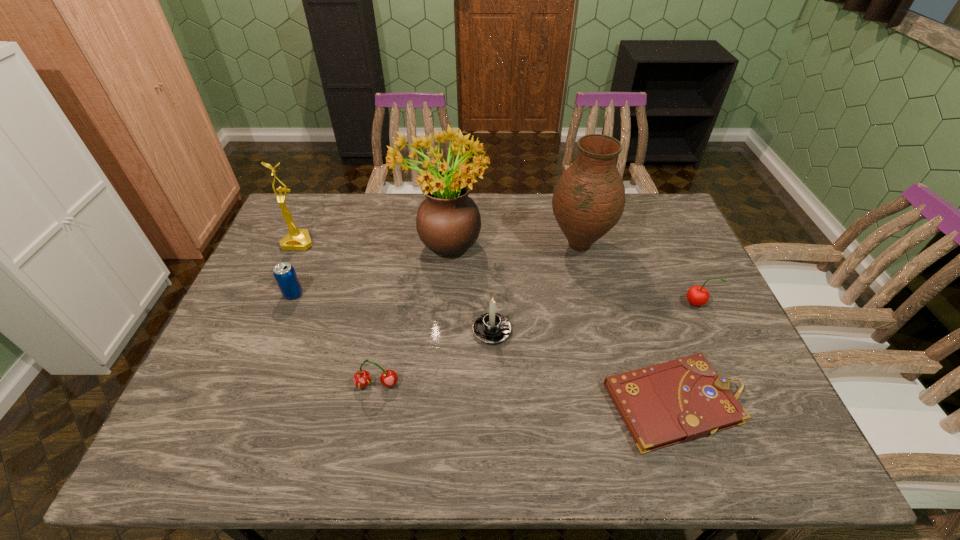
I want to click on object positioned at the near edge, so click(681, 400).

The height and width of the screenshot is (540, 960). What are the coordinates of `award at the left edge` in the screenshot? It's located at (297, 239).

Image resolution: width=960 pixels, height=540 pixels. I want to click on pop soda located at the left edge, so click(x=284, y=273).

Find the location of `cherry located at the right edge`. cherry located at the right edge is located at coordinates (697, 295).

In order to click on notebook present at the right edge in this screenshot , I will do `click(681, 400)`.

The width and height of the screenshot is (960, 540). Identify the location of object that is at the far left corner. (297, 239).

Locate an element on the screen. object positioned at the near right corner is located at coordinates (681, 400).

Identify the location of vacant space at the far edge. (546, 200).

In the image, there is a desktop. Identify the location of free space at the near edge. The image size is (960, 540). (493, 435).

In the image, there is a desktop. Where is `free region at the left edge`? The height and width of the screenshot is (540, 960). free region at the left edge is located at coordinates (300, 297).